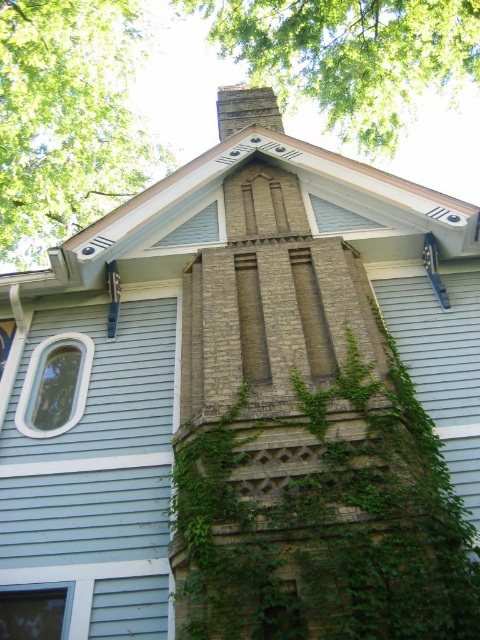
Can you confirm if green leafy tree at upper left is bigger than green leafy tree at upper center?

Yes, green leafy tree at upper left is bigger than green leafy tree at upper center.

The width and height of the screenshot is (480, 640). What do you see at coordinates (68, 118) in the screenshot?
I see `green leafy tree at upper left` at bounding box center [68, 118].

In order to click on green leafy tree at upper left in this screenshot , I will do `click(68, 118)`.

Image resolution: width=480 pixels, height=640 pixels. Identify the location of green leafy tree at upper left. (68, 118).

Can you confirm if green leafy tree at upper center is positioned below white plastic window at upper left?

No.

How much distance is there between green leafy tree at upper center and white plastic window at upper left?

The distance of green leafy tree at upper center from white plastic window at upper left is 9.74 meters.

Image resolution: width=480 pixels, height=640 pixels. What do you see at coordinates (350, 56) in the screenshot?
I see `green leafy tree at upper center` at bounding box center [350, 56].

Locate an element on the screen. green leafy tree at upper center is located at coordinates (350, 56).

Does white plastic window at upper left appear on the left side of clear glass window at lower left?

Yes, white plastic window at upper left is to the left of clear glass window at lower left.

Does white plastic window at upper left appear under clear glass window at lower left?

Incorrect, white plastic window at upper left is not positioned below clear glass window at lower left.

Does point (39, 406) lie behind point (28, 628)?

Yes, point (39, 406) is farther from viewer.

Identify the location of white plastic window at upper left. The height and width of the screenshot is (640, 480). (55, 385).